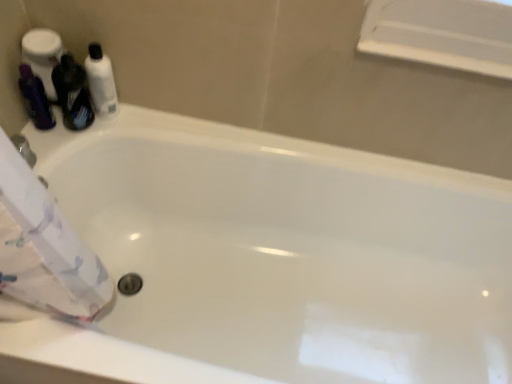
This screenshot has height=384, width=512. Find the location of `matte black bottle at left`. matte black bottle at left is located at coordinates 72,93.

This screenshot has height=384, width=512. What do you see at coordinates (101, 82) in the screenshot?
I see `white glossy bottle at upper left, which is the 2th toiletry from left to right` at bounding box center [101, 82].

Locate an element on the screen. This screenshot has height=384, width=512. matte purple shampoo at left, which is the 1th toiletry in left-to-right order is located at coordinates (35, 98).

The image size is (512, 384). Identify the location of matte black bottle at left. (72, 93).

Considering the positions of objects matte purple shampoo at left, which is the 1th toiletry in left-to-right order, and white glossy bottle at upper left, positioned as the first toiletry in right-to-left order, in the image provided, who is behind, matte purple shampoo at left, which is the 1th toiletry in left-to-right order, or white glossy bottle at upper left, positioned as the first toiletry in right-to-left order,?

Positioned behind is white glossy bottle at upper left, positioned as the first toiletry in right-to-left order.

Considering the positions of objects matte purple shampoo at left, which appears as the second toiletry when viewed from the right, and white glossy bottle at upper left, which is the 2th toiletry from left to right, in the image provided, who is more to the right, matte purple shampoo at left, which appears as the second toiletry when viewed from the right, or white glossy bottle at upper left, which is the 2th toiletry from left to right,?

From the viewer's perspective, white glossy bottle at upper left, which is the 2th toiletry from left to right, appears more on the right side.

Can you confirm if matte purple shampoo at left, which is the 1th toiletry in left-to-right order, is taller than white glossy bottle at upper left, which is the 2th toiletry from left to right?

No.

Does white glossy bottle at upper left, which is the 2th toiletry from left to right, appear on the left side of matte black bottle at left?

In fact, white glossy bottle at upper left, which is the 2th toiletry from left to right, is to the right of matte black bottle at left.

How distant is white glossy bottle at upper left, which is the 2th toiletry from left to right, from matte black bottle at left?

The distance of white glossy bottle at upper left, which is the 2th toiletry from left to right, from matte black bottle at left is 1.83 inches.

Between white glossy bottle at upper left, positioned as the first toiletry in right-to-left order, and matte black bottle at left, which one is positioned behind?

white glossy bottle at upper left, positioned as the first toiletry in right-to-left order, is further from the camera.

Locate an element on the screen. The height and width of the screenshot is (384, 512). toiletry above the matte black bottle at left (from a real-world perspective) is located at coordinates (101, 82).

Based on the photo, considering the sizes of objects matte black bottle at left and matte purple shampoo at left, which is the 1th toiletry in left-to-right order, in the image provided, who is smaller, matte black bottle at left or matte purple shampoo at left, which is the 1th toiletry in left-to-right order,?

With smaller size is matte purple shampoo at left, which is the 1th toiletry in left-to-right order.

From the image's perspective, who appears lower, matte black bottle at left or matte purple shampoo at left, which is the 1th toiletry in left-to-right order?

matte purple shampoo at left, which is the 1th toiletry in left-to-right order, is shown below in the image.

Is matte purple shampoo at left, which appears as the second toiletry when viewed from the right, completely or partially inside matte black bottle at left?

No, matte purple shampoo at left, which appears as the second toiletry when viewed from the right, is not a part of matte black bottle at left.

Considering the relative positions of matte black bottle at left and matte purple shampoo at left, which appears as the second toiletry when viewed from the right, in the image provided, is matte black bottle at left to the left or to the right of matte purple shampoo at left, which appears as the second toiletry when viewed from the right,?

matte black bottle at left is to the right of matte purple shampoo at left, which appears as the second toiletry when viewed from the right.

Is point (88, 75) behind point (22, 84)?

Yes, point (88, 75) is behind point (22, 84).

Does white glossy bottle at upper left, which is the 2th toiletry from left to right, have a larger size compared to matte purple shampoo at left, which is the 1th toiletry in left-to-right order?

Correct, white glossy bottle at upper left, which is the 2th toiletry from left to right, is larger in size than matte purple shampoo at left, which is the 1th toiletry in left-to-right order.

From a real-world perspective, is white glossy bottle at upper left, which is the 2th toiletry from left to right, located higher than matte purple shampoo at left, which appears as the second toiletry when viewed from the right?

Correct, in the physical world, white glossy bottle at upper left, which is the 2th toiletry from left to right, is higher than matte purple shampoo at left, which appears as the second toiletry when viewed from the right.

From their relative heights in the image, would you say white glossy bottle at upper left, positioned as the first toiletry in right-to-left order, is taller or shorter than matte purple shampoo at left, which is the 1th toiletry in left-to-right order?

In the image, white glossy bottle at upper left, positioned as the first toiletry in right-to-left order, appears to be taller than matte purple shampoo at left, which is the 1th toiletry in left-to-right order.

Between matte purple shampoo at left, which appears as the second toiletry when viewed from the right, and matte black bottle at left, which one has larger width?

Wider between the two is matte black bottle at left.

From a real-world perspective, is matte purple shampoo at left, which is the 1th toiletry in left-to-right order, physically below matte black bottle at left?

Yes, from a real-world perspective, matte purple shampoo at left, which is the 1th toiletry in left-to-right order, is under matte black bottle at left.

Is there a large distance between matte purple shampoo at left, which is the 1th toiletry in left-to-right order, and matte black bottle at left?

They are positioned close to each other.

From the image's perspective, which object appears higher, matte purple shampoo at left, which is the 1th toiletry in left-to-right order, or matte black bottle at left?

matte black bottle at left is shown above in the image.

Is there a large distance between matte black bottle at left and white glossy bottle at upper left, which is the 2th toiletry from left to right?

They are positioned close to each other.

From the matte black bottle at left, count 2nd toiletrys backward and point to it. Please provide its 2D coordinates.

[(101, 82)]

Would you say matte black bottle at left is inside or outside white glossy bottle at upper left, positioned as the first toiletry in right-to-left order?

matte black bottle at left is located beyond the bounds of white glossy bottle at upper left, positioned as the first toiletry in right-to-left order.

Identify the location of toiletry on the left of white glossy bottle at upper left, positioned as the first toiletry in right-to-left order. (35, 98).

The image size is (512, 384). I want to click on cleaning product in front of the white glossy bottle at upper left, positioned as the first toiletry in right-to-left order, so click(x=72, y=93).

When comparing their distances from matte purple shampoo at left, which is the 1th toiletry in left-to-right order, does white glossy bottle at upper left, positioned as the first toiletry in right-to-left order, or matte black bottle at left seem closer?

matte black bottle at left is positioned closer to the anchor matte purple shampoo at left, which is the 1th toiletry in left-to-right order.

Based on their spatial positions, is matte purple shampoo at left, which appears as the second toiletry when viewed from the right, or white glossy bottle at upper left, positioned as the first toiletry in right-to-left order, further from matte black bottle at left?

matte purple shampoo at left, which appears as the second toiletry when viewed from the right, is positioned further to the anchor matte black bottle at left.

When comparing their distances from matte black bottle at left, does white glossy bottle at upper left, positioned as the first toiletry in right-to-left order, or matte purple shampoo at left, which appears as the second toiletry when viewed from the right, seem further?

The object further to matte black bottle at left is matte purple shampoo at left, which appears as the second toiletry when viewed from the right.

From the image, which object appears to be farther from white glossy bottle at upper left, which is the 2th toiletry from left to right, matte black bottle at left or matte purple shampoo at left, which is the 1th toiletry in left-to-right order?

matte purple shampoo at left, which is the 1th toiletry in left-to-right order, is further to white glossy bottle at upper left, which is the 2th toiletry from left to right.

When comparing their distances from white glossy bottle at upper left, which is the 2th toiletry from left to right, does matte purple shampoo at left, which is the 1th toiletry in left-to-right order, or matte black bottle at left seem closer?

The object closer to white glossy bottle at upper left, which is the 2th toiletry from left to right, is matte black bottle at left.

From the image, which object appears to be farther from matte purple shampoo at left, which appears as the second toiletry when viewed from the right, matte black bottle at left or white glossy bottle at upper left, which is the 2th toiletry from left to right?

Among the two, white glossy bottle at upper left, which is the 2th toiletry from left to right, is located further to matte purple shampoo at left, which appears as the second toiletry when viewed from the right.

Identify the location of cleaning product between matte purple shampoo at left, which appears as the second toiletry when viewed from the right, and white glossy bottle at upper left, positioned as the first toiletry in right-to-left order. (72, 93).